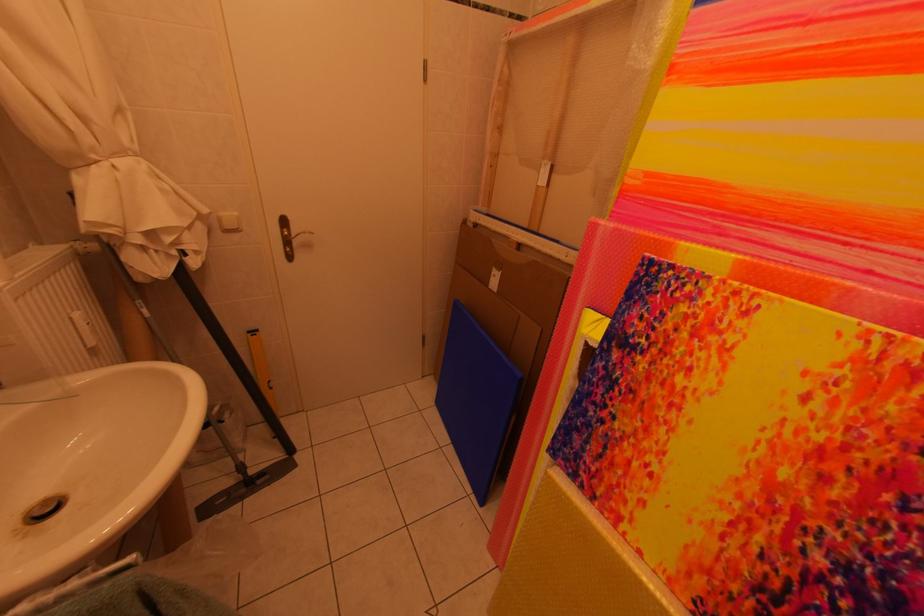
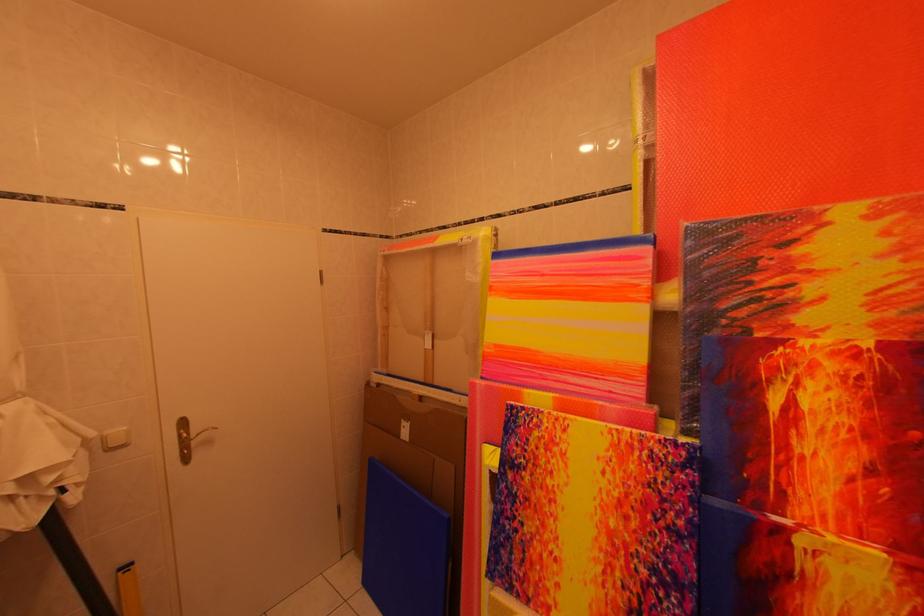
The images are taken continuously from a first-person perspective. In which direction is your viewpoint rotating?

The rotation direction of the camera is right-up.